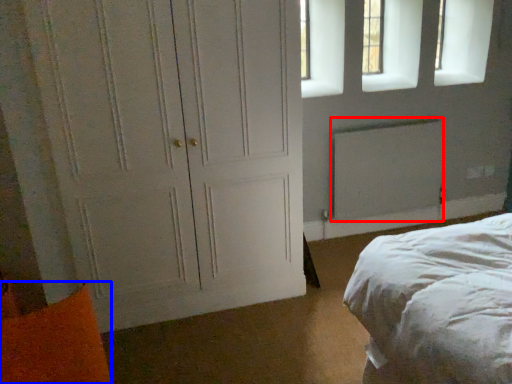
Question: Which object is closer to the camera taking this photo, radiator (highlighted by a red box) or pillow (highlighted by a blue box)?

Choices:
 (A) radiator
 (B) pillow

Answer: (B)